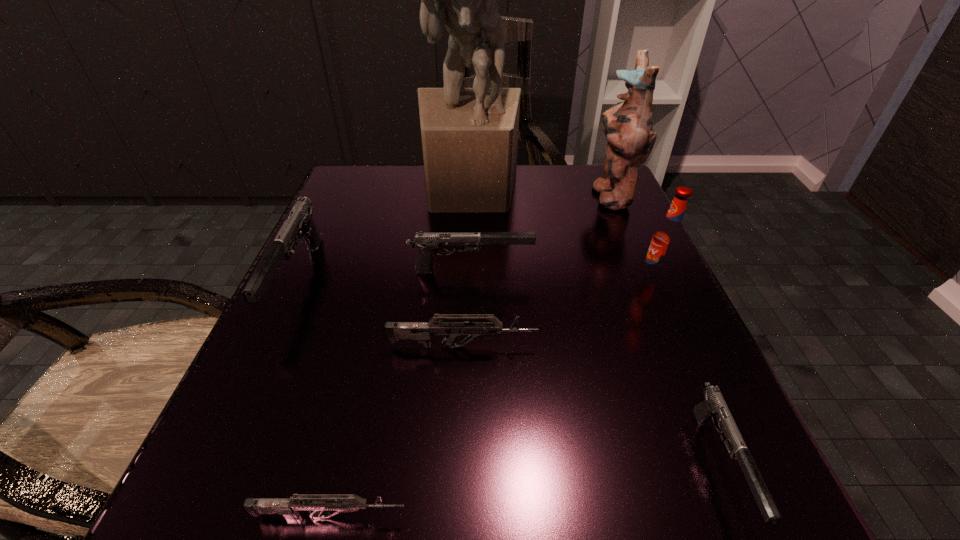
Identify the location of the tallest object. Image resolution: width=960 pixels, height=540 pixels. (469, 135).

The width and height of the screenshot is (960, 540). I want to click on gray sculpture, so click(469, 135).

Locate an element on the screen. The width and height of the screenshot is (960, 540). pink figurine is located at coordinates (628, 126).

Find the location of a particular element. This screenshot has height=540, width=960. the second tallest object is located at coordinates (628, 126).

Image resolution: width=960 pixels, height=540 pixels. Identify the location of root beer. (668, 239).

You are a GUI agent. You are given a task and a screenshot of the screen. Output one action in this format:
    pyautogui.click(x=<x>, y=<y>)
    Task: Click on the red root beer
    This screenshot has width=960, height=540.
    Given the screenshot: What is the action you would take?
    pyautogui.click(x=668, y=239)

Where is `the fifth shortest object`? the fifth shortest object is located at coordinates (300, 223).

In order to click on the leftmost object in this screenshot , I will do `click(300, 223)`.

Where is `the second gray gun from left to right`? The image size is (960, 540). the second gray gun from left to right is located at coordinates (426, 243).

The height and width of the screenshot is (540, 960). I want to click on the second tallest gun, so click(426, 243).